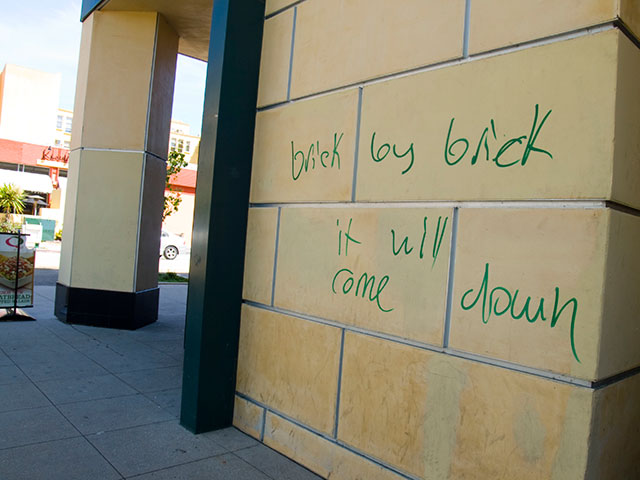
You are a GUI agent. You are given a task and a screenshot of the screen. Output one action in this format:
    pyautogui.click(x=<x>, y=<y>)
    Task: Click on the tiled floor
    
    Given the screenshot: What is the action you would take?
    pyautogui.click(x=115, y=411)